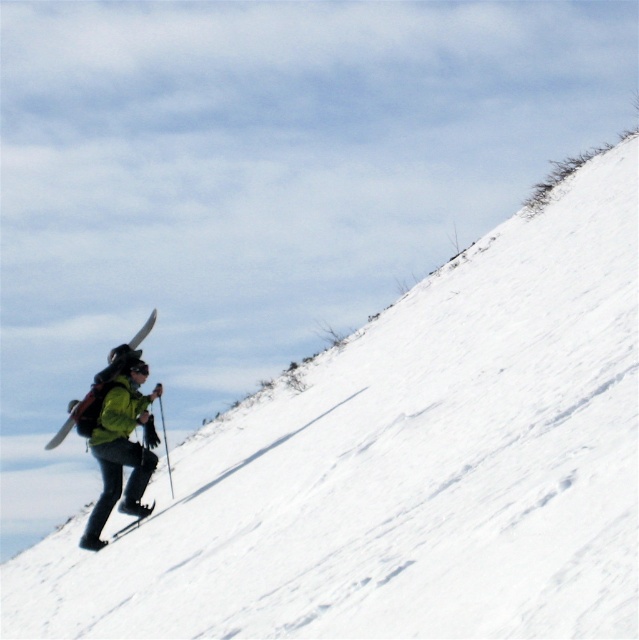
You are a drone operator trying to capture a photo of the person on the snowy slope. The camera is currently focused on the point at coordinates point (116, 436). According to the scene description, which object is located at that point?

The point at coordinates point (116, 436) marks the green fabric jacket at lower left.

You are a hiker trying to locate your skis on the snowy slope. You see the matte white ski at upper left and the matte black ski at lower left. Which ski is located higher on the slope?

The matte white ski at upper left is positioned higher on the slope than the matte black ski at lower left.